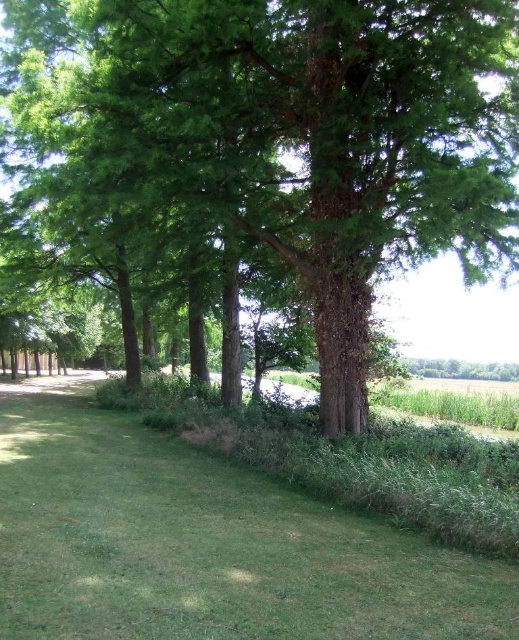
Question: Is green rough bark tree at center closer to camera compared to green grass at lower center?

Choices:
 (A) no
 (B) yes

Answer: (A)

Question: Considering the relative positions of green rough bark tree at center and green grass at lower center in the image provided, where is green rough bark tree at center located with respect to green grass at lower center?

Choices:
 (A) above
 (B) below

Answer: (A)

Question: Is green rough bark tree at center smaller than green grass at lower center?

Choices:
 (A) no
 (B) yes

Answer: (A)

Question: Among these points, which one is farthest from the camera?

Choices:
 (A) [338, 528]
 (B) [471, 243]

Answer: (B)

Question: Which point is closer to the camera?

Choices:
 (A) green rough bark tree at center
 (B) green grass at lower center

Answer: (B)